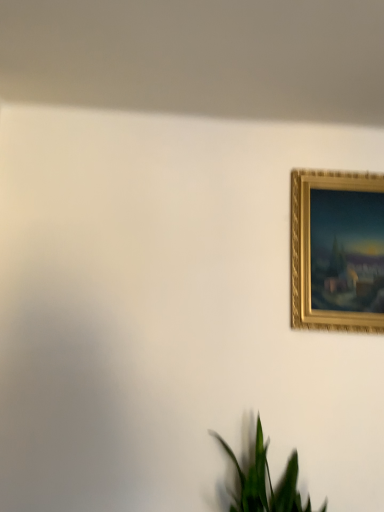
Question: Would you say green leafy plant at lower center is part of gold textured picture frame at upper right's contents?

Choices:
 (A) no
 (B) yes

Answer: (A)

Question: From the image's perspective, is gold textured picture frame at upper right beneath green leafy plant at lower center?

Choices:
 (A) yes
 (B) no

Answer: (B)

Question: Can you confirm if gold textured picture frame at upper right is smaller than green leafy plant at lower center?

Choices:
 (A) no
 (B) yes

Answer: (B)

Question: Is gold textured picture frame at upper right outside green leafy plant at lower center?

Choices:
 (A) yes
 (B) no

Answer: (A)

Question: Does gold textured picture frame at upper right have a larger size compared to green leafy plant at lower center?

Choices:
 (A) yes
 (B) no

Answer: (B)

Question: Can you confirm if gold textured picture frame at upper right is positioned to the left of green leafy plant at lower center?

Choices:
 (A) yes
 (B) no

Answer: (B)

Question: Is green leafy plant at lower center smaller than gold textured picture frame at upper right?

Choices:
 (A) no
 (B) yes

Answer: (A)

Question: Does green leafy plant at lower center have a larger size compared to gold textured picture frame at upper right?

Choices:
 (A) yes
 (B) no

Answer: (A)

Question: Considering the relative positions of green leafy plant at lower center and gold textured picture frame at upper right in the image provided, is green leafy plant at lower center to the left of gold textured picture frame at upper right from the viewer's perspective?

Choices:
 (A) yes
 (B) no

Answer: (A)

Question: Does green leafy plant at lower center come in front of gold textured picture frame at upper right?

Choices:
 (A) no
 (B) yes

Answer: (B)

Question: Can you confirm if green leafy plant at lower center is thinner than gold textured picture frame at upper right?

Choices:
 (A) yes
 (B) no

Answer: (B)

Question: Is green leafy plant at lower center at the right side of gold textured picture frame at upper right?

Choices:
 (A) yes
 (B) no

Answer: (B)

Question: Is point (261, 509) closer or farther from the camera than point (317, 201)?

Choices:
 (A) farther
 (B) closer

Answer: (B)